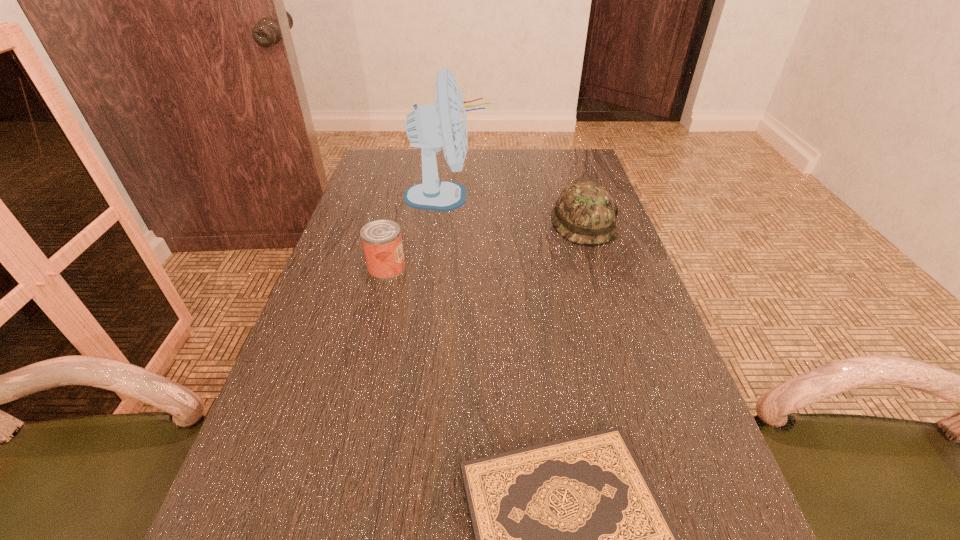
The image size is (960, 540). I want to click on the tallest object, so click(x=444, y=124).

Locate an element on the screen. The width and height of the screenshot is (960, 540). headwear is located at coordinates (584, 213).

In order to click on can in this screenshot , I will do `click(381, 239)`.

At what (x,y) coordinates should I click in order to perform the action: click on vacant space located on the grille of the tallest object. Please return your answer as a coordinate pair (x, y). The height and width of the screenshot is (540, 960). Looking at the image, I should click on (513, 197).

Locate an element on the screen. This screenshot has height=540, width=960. vacant space located 0.060m on the left of the headwear is located at coordinates (530, 223).

Where is `blank area located on the right of the can`? This screenshot has height=540, width=960. blank area located on the right of the can is located at coordinates (536, 268).

At what (x,y) coordinates should I click in order to perform the action: click on object located at the far edge. Please return your answer as a coordinate pair (x, y). Looking at the image, I should click on (444, 124).

The image size is (960, 540). What are the coordinates of `fan present at the left edge` in the screenshot? It's located at (444, 124).

Locate an element on the screen. The height and width of the screenshot is (540, 960). can located in the left edge section of the desktop is located at coordinates [x=381, y=239].

You are a GUI agent. You are given a task and a screenshot of the screen. Output one action in this format:
    pyautogui.click(x=<x>, y=<y>)
    Task: Click on the object present at the right edge
    The height and width of the screenshot is (540, 960).
    Given the screenshot: What is the action you would take?
    pyautogui.click(x=584, y=213)